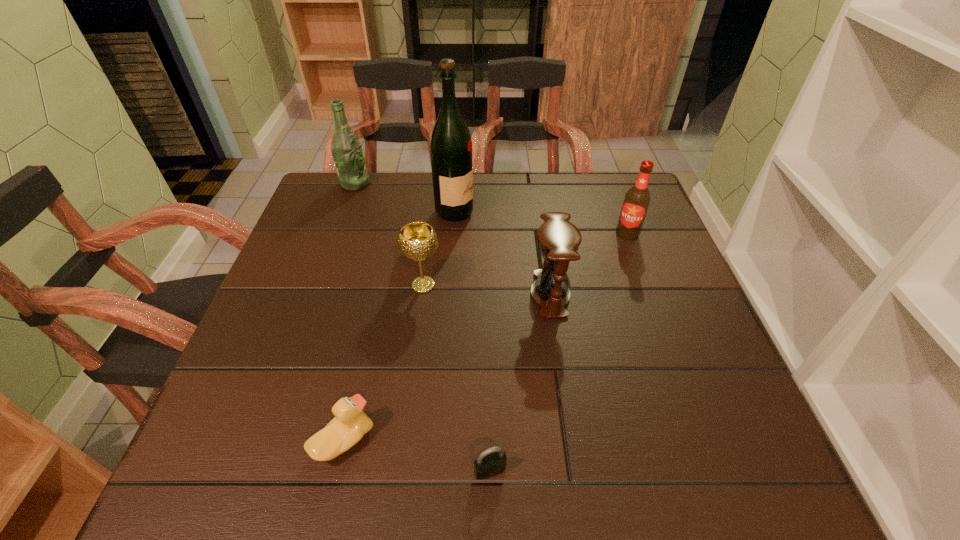
Locate an element on the screen. empty space between the taller beer bottle and the chalice is located at coordinates (389, 234).

The width and height of the screenshot is (960, 540). Find the location of `vacant space that's between the sixth nearest object and the farthest object`. vacant space that's between the sixth nearest object and the farthest object is located at coordinates (404, 198).

The height and width of the screenshot is (540, 960). In order to click on free space between the liquor and the shortest object in this screenshot , I will do `click(472, 341)`.

This screenshot has width=960, height=540. What are the coordinates of `object that ranks as the fourth closest to the second object from left to right` in the screenshot? It's located at (451, 145).

Identify the location of object that is the closest one to the sixth shortest object. (451, 145).

You are a GUI agent. You are given a task and a screenshot of the screen. Output one action in this format:
    pyautogui.click(x=<x>, y=<y>)
    Task: Click on the blank area in the image that satisfies the following two spatial constraints: 1. on the surface of the shortest object; 2. on the left side of the farthest object
    The height and width of the screenshot is (540, 960).
    Given the screenshot: What is the action you would take?
    pyautogui.click(x=252, y=471)

Locate an element on the screen. free location that satisfies the following two spatial constraints: 1. on the surface of the chalice; 2. on the right side of the farther beer bottle is located at coordinates (318, 285).

Find the location of a particular element. vacant space that satisfies the following two spatial constraints: 1. on the surface of the hourglass; 2. on the right side of the left beer bottle is located at coordinates (315, 294).

At what (x,y) coordinates should I click in order to perform the action: click on vacant space that satisfies the following two spatial constraints: 1. on the front-facing side of the liquor; 2. on the left side of the hourglass. Please return your answer as a coordinate pair (x, y). This screenshot has width=960, height=540. Looking at the image, I should click on (449, 294).

Where is `free space that satisfies the following two spatial constraints: 1. on the front-facing side of the padlock; 2. on the right side of the liquor`? free space that satisfies the following two spatial constraints: 1. on the front-facing side of the padlock; 2. on the right side of the liquor is located at coordinates (437, 471).